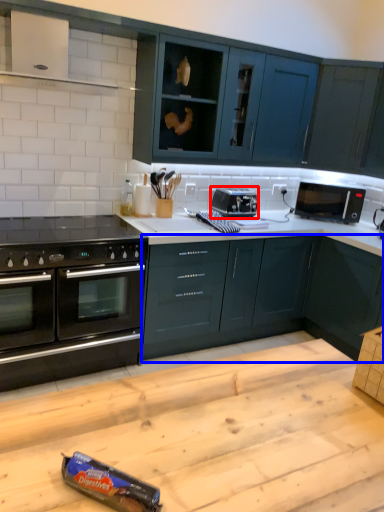
Question: Which object is further to the camera taking this photo, appliance (highlighted by a red box) or cabinetry (highlighted by a blue box)?

Choices:
 (A) appliance
 (B) cabinetry

Answer: (A)